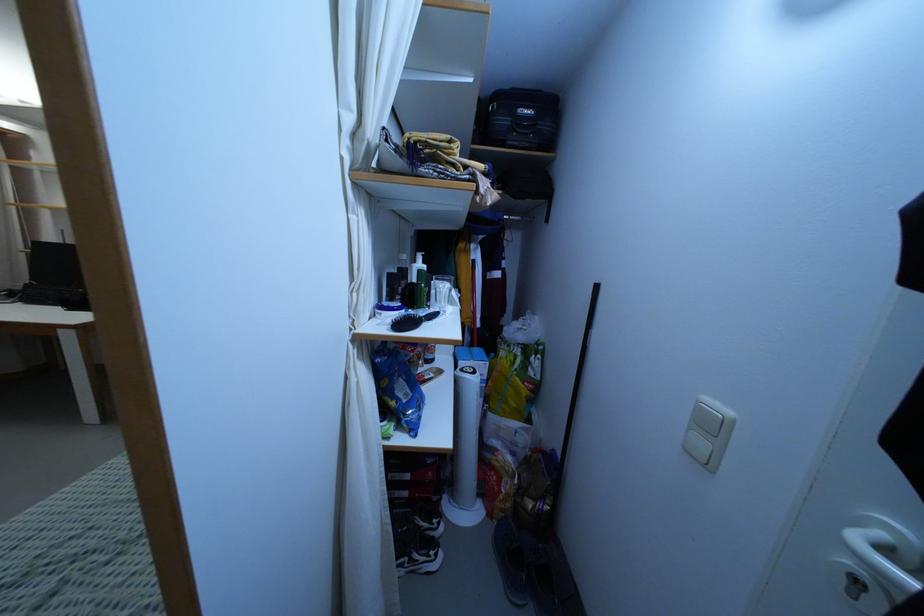
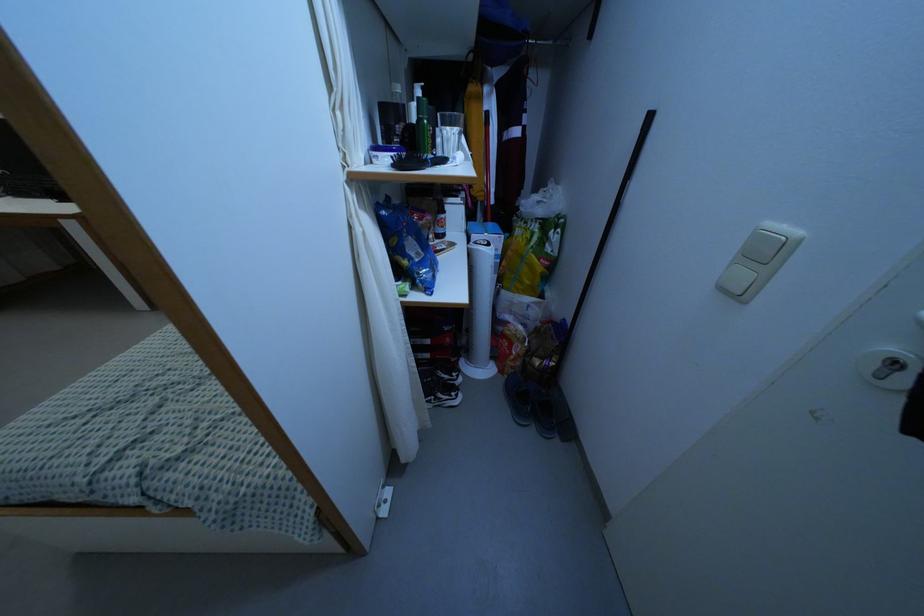
Find the pixel in the second image that matches [701,444] in the first image.

(743, 276)